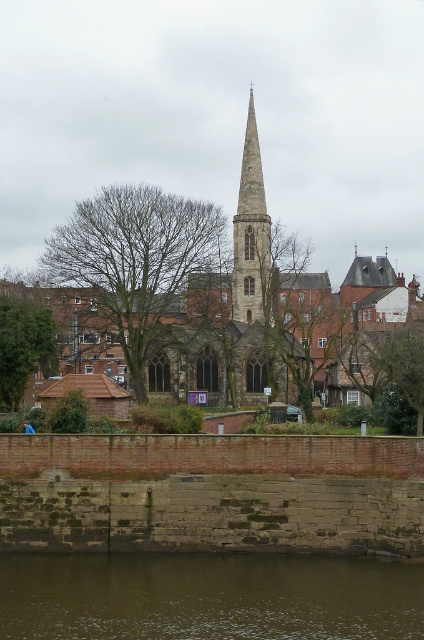
Is smooth stone spire at center smaller than green leafy tree at lower right?

Yes.

Can you confirm if smooth stone spire at center is thinner than green leafy tree at lower right?

Indeed, smooth stone spire at center has a lesser width compared to green leafy tree at lower right.

Find the location of a particular element. This screenshot has height=640, width=424. smooth stone spire at center is located at coordinates (251, 230).

Is brown muddy water at lower center to the left of stone church at center from the viewer's perspective?

Yes, brown muddy water at lower center is to the left of stone church at center.

Does brown muddy water at lower center have a smaller size compared to stone church at center?

Yes.

Where is `brown muddy water at lower center`? The width and height of the screenshot is (424, 640). brown muddy water at lower center is located at coordinates (209, 596).

Does stone church at center have a smaller size compared to green leafy tree at lower right?

No, stone church at center is not smaller than green leafy tree at lower right.

Does point (304, 378) come farther from viewer compared to point (388, 362)?

Yes, point (304, 378) is farther from viewer.

Image resolution: width=424 pixels, height=640 pixels. Identify the location of stone church at center. (286, 259).